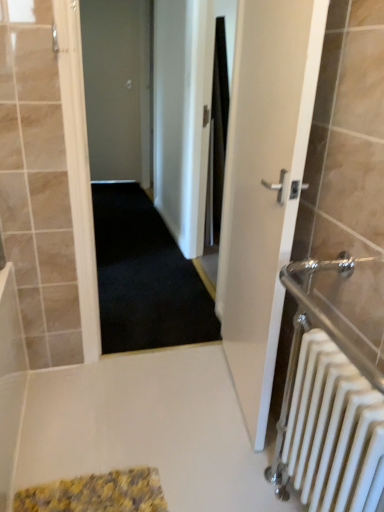
Question: Can white glossy door at center right, which appears as the 2th door when viewed from the left, be found inside matte gray door at center, the 2th door from the right?

Choices:
 (A) no
 (B) yes

Answer: (A)

Question: From a real-world perspective, does matte gray door at center, the second door when ordered from bottom to top, stand above white glossy door at center right, which is the 1th door from front to back?

Choices:
 (A) yes
 (B) no

Answer: (A)

Question: Is matte gray door at center, which ranks as the first door in top-to-bottom order, taller than white glossy door at center right, placed as the 1th door when sorted from right to left?

Choices:
 (A) no
 (B) yes

Answer: (B)

Question: Considering the relative sizes of matte gray door at center, the 2th door from the right, and white glossy door at center right, which appears as the 2th door when viewed from the left, in the image provided, is matte gray door at center, the 2th door from the right, bigger than white glossy door at center right, which appears as the 2th door when viewed from the left,?

Choices:
 (A) yes
 (B) no

Answer: (B)

Question: From the image's perspective, is matte gray door at center, the 1th door in the back-to-front sequence, located above white glossy door at center right, which appears as the 2th door when viewed from the left?

Choices:
 (A) no
 (B) yes

Answer: (B)

Question: Considering the relative positions of white glossy door at center right, placed as the 1th door when sorted from right to left, and white metallic radiator at right in the image provided, is white glossy door at center right, placed as the 1th door when sorted from right to left, to the left or to the right of white metallic radiator at right?

Choices:
 (A) right
 (B) left

Answer: (B)

Question: Is point (264, 384) positioned closer to the camera than point (355, 435)?

Choices:
 (A) farther
 (B) closer

Answer: (A)

Question: From a real-world perspective, is white glossy door at center right, the 2th door viewed from the top, physically located above or below white metallic radiator at right?

Choices:
 (A) above
 (B) below

Answer: (A)

Question: Considering the positions of white glossy door at center right, arranged as the 2th door when viewed from the back, and white metallic radiator at right in the image, is white glossy door at center right, arranged as the 2th door when viewed from the back, taller or shorter than white metallic radiator at right?

Choices:
 (A) short
 (B) tall

Answer: (B)

Question: Looking at the image, does white glossy door at center right, which is the 1th door in bottom-to-top order, seem bigger or smaller compared to dark carpet at center?

Choices:
 (A) small
 (B) big

Answer: (B)

Question: From the image's perspective, is white glossy door at center right, which appears as the 2th door when viewed from the left, positioned above or below dark carpet at center?

Choices:
 (A) above
 (B) below

Answer: (B)

Question: From a real-world perspective, relative to dark carpet at center, is white glossy door at center right, which is the 1th door from front to back, vertically above or below?

Choices:
 (A) below
 (B) above

Answer: (A)

Question: Is white glossy door at center right, which is the 1th door from front to back, wider or thinner than dark carpet at center?

Choices:
 (A) wide
 (B) thin

Answer: (A)

Question: From the image's perspective, is white glossy door at center right, the 2th door viewed from the top, positioned above or below black carpet at center?

Choices:
 (A) above
 (B) below

Answer: (B)

Question: From a real-world perspective, is white glossy door at center right, which appears as the 2th door when viewed from the left, positioned above or below black carpet at center?

Choices:
 (A) below
 (B) above

Answer: (B)